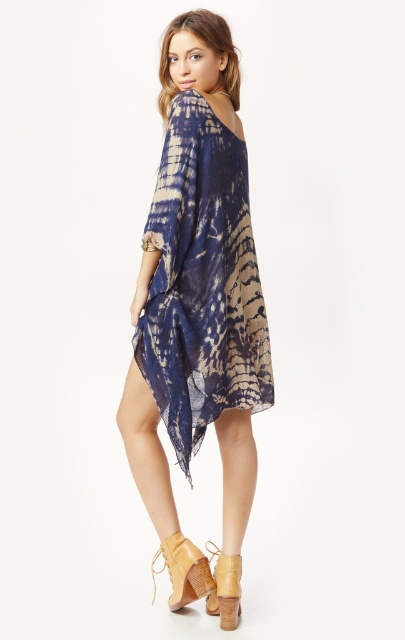
Is point (202, 132) in front of point (217, 602)?

Yes, point (202, 132) is in front of point (217, 602).

Is tie-dye chiffon dress at center to the left of matte tan leather sandal at lower center from the viewer's perspective?

Correct, you'll find tie-dye chiffon dress at center to the left of matte tan leather sandal at lower center.

This screenshot has width=405, height=640. Find the location of `tie-dye chiffon dress at center`. tie-dye chiffon dress at center is located at coordinates (202, 282).

Which is below, tie-dye chiffon dress at center or tan suede boot at lower center?

tan suede boot at lower center

Does point (211, 307) come closer to viewer compared to point (187, 554)?

Yes, it is in front of point (187, 554).

Describe the element at coordinates (202, 282) in the screenshot. This screenshot has height=640, width=405. I see `tie-dye chiffon dress at center` at that location.

The width and height of the screenshot is (405, 640). I want to click on tie-dye chiffon dress at center, so click(202, 282).

Is tan suede boot at lower center further to camera compared to matte tan leather sandal at lower center?

No.

Is tan suede boot at lower center wider than matte tan leather sandal at lower center?

Indeed, tan suede boot at lower center has a greater width compared to matte tan leather sandal at lower center.

Does point (185, 602) come behind point (238, 596)?

Yes, it is.

The height and width of the screenshot is (640, 405). Find the location of `tan suede boot at lower center`. tan suede boot at lower center is located at coordinates (183, 572).